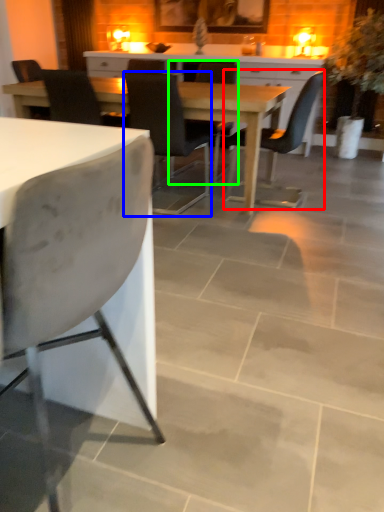
Question: Which object is the farthest from chair (highlighted by a red box)? Choose among these: chair (highlighted by a blue box) or chair (highlighted by a green box).

Choices:
 (A) chair
 (B) chair

Answer: (A)